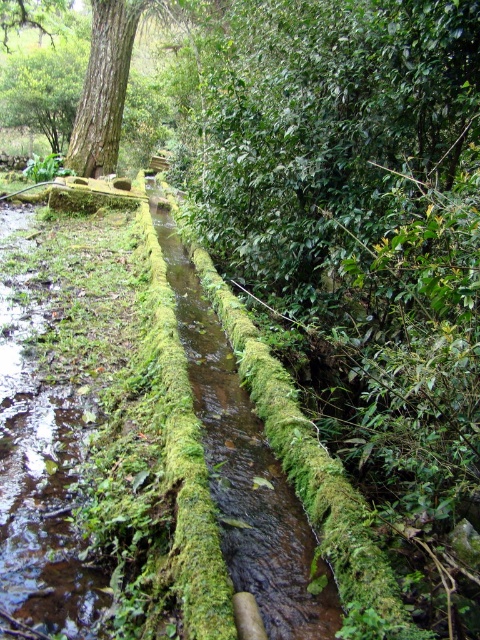
Where is `green mossy water at center`? Image resolution: width=480 pixels, height=640 pixels. green mossy water at center is located at coordinates (37, 468).

Is green mossy water at center above brown rough tree trunk at upper left?

No, green mossy water at center is not above brown rough tree trunk at upper left.

Between point (61, 570) and point (120, 49), which one is positioned in front?

Point (61, 570) is in front.

Image resolution: width=480 pixels, height=640 pixels. I want to click on green mossy water at center, so click(37, 468).